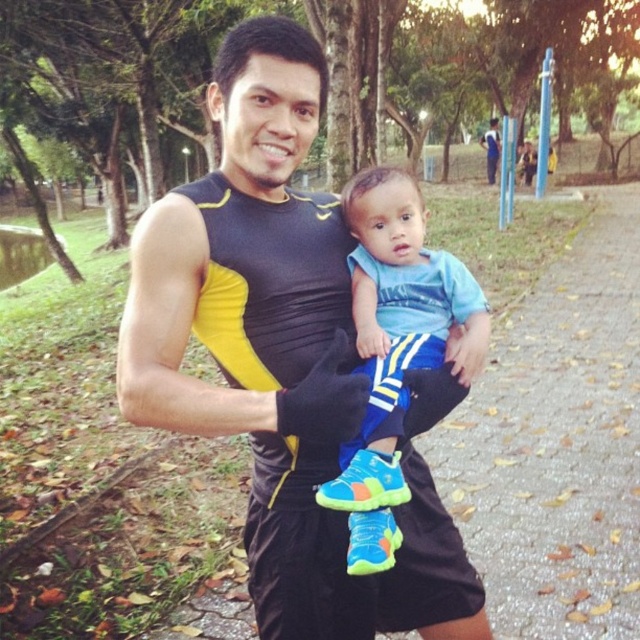
Question: Does black/yellow athletic top at center have a greater width compared to blue fabric pants at center?

Choices:
 (A) no
 (B) yes

Answer: (B)

Question: Can you confirm if black/yellow athletic top at center is positioned to the right of blue fabric pants at center?

Choices:
 (A) no
 (B) yes

Answer: (A)

Question: Which point appears farthest from the camera in this image?

Choices:
 (A) (492, 168)
 (B) (378, 554)

Answer: (A)

Question: Among these objects, which one is nearest to the camera?

Choices:
 (A) black/yellow athletic top at center
 (B) blue fabric shirt at upper center

Answer: (A)

Question: Which point appears closest to the camera in this image?

Choices:
 (A) (340, 634)
 (B) (358, 561)

Answer: (B)

Question: Is black/yellow athletic top at center wider than blue fabric shirt at upper center?

Choices:
 (A) no
 (B) yes

Answer: (B)